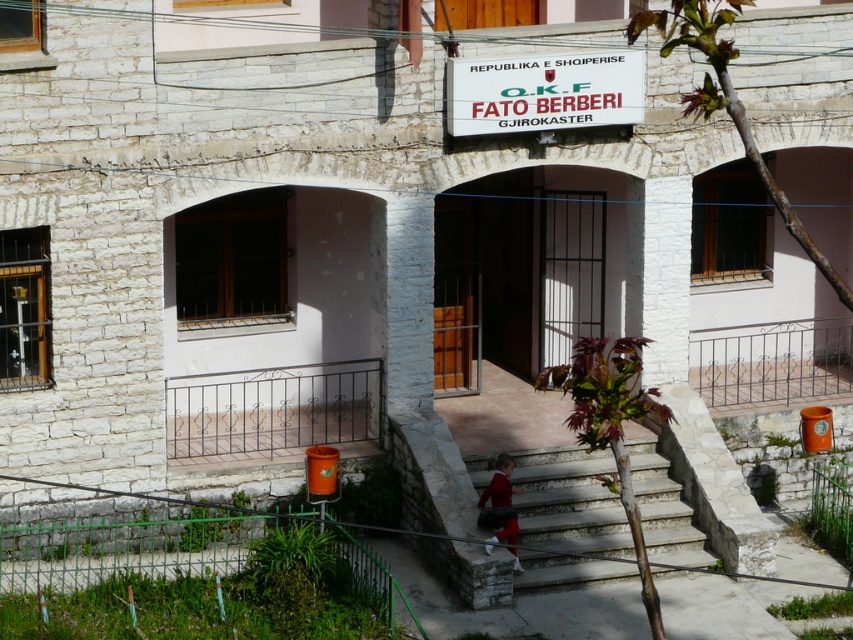
Question: Is white stone stairs at center wider than white plastic sign at upper center?

Choices:
 (A) yes
 (B) no

Answer: (A)

Question: Can you confirm if white stone stairs at center is thinner than white plastic sign at upper center?

Choices:
 (A) no
 (B) yes

Answer: (A)

Question: Does white stone stairs at center have a lesser width compared to white plastic sign at upper center?

Choices:
 (A) yes
 (B) no

Answer: (B)

Question: Which point is farther to the camera?

Choices:
 (A) (606, 116)
 (B) (544, 456)

Answer: (B)

Question: Which point is farther to the camera?

Choices:
 (A) (614, 538)
 (B) (517, 65)

Answer: (A)